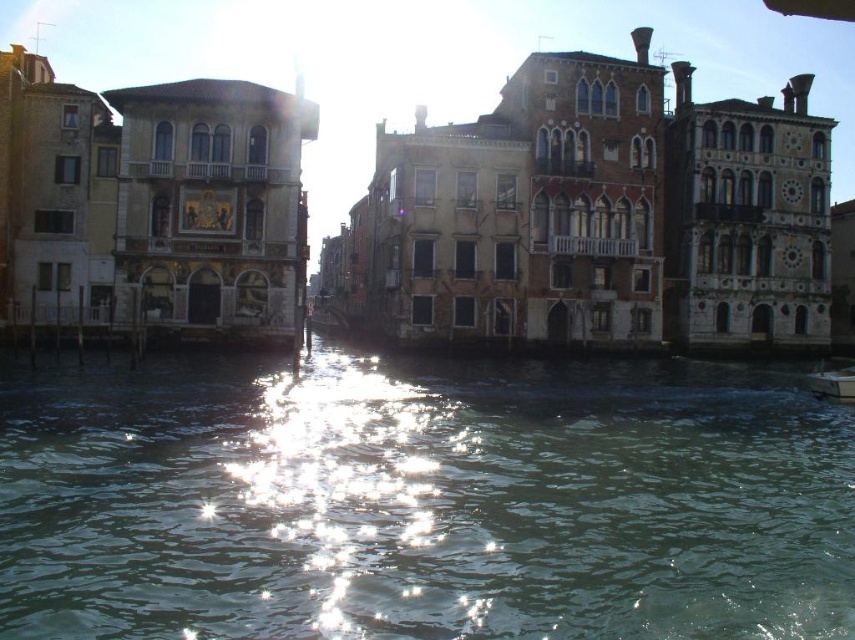
Is greenish water at center positioned before metallic silver boat at lower right?

Yes, greenish water at center is in front of metallic silver boat at lower right.

Can you confirm if greenish water at center is positioned above metallic silver boat at lower right?

No, greenish water at center is not above metallic silver boat at lower right.

Find the location of `greenish water at center`. greenish water at center is located at coordinates (422, 500).

The width and height of the screenshot is (855, 640). Find the location of `greenish water at center`. greenish water at center is located at coordinates (422, 500).